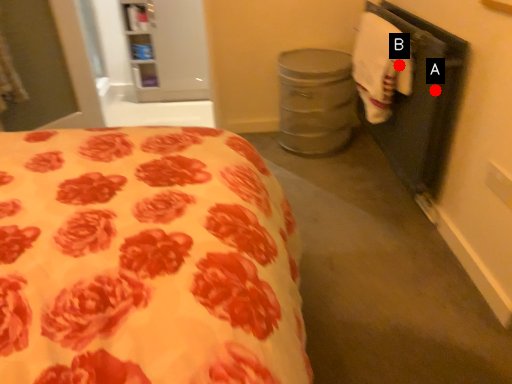
Question: Two points are circled on the image, labeled by A and B beside each circle. Which point appears closest to the camera in this image?

Choices:
 (A) A is closer
 (B) B is closer

Answer: (A)